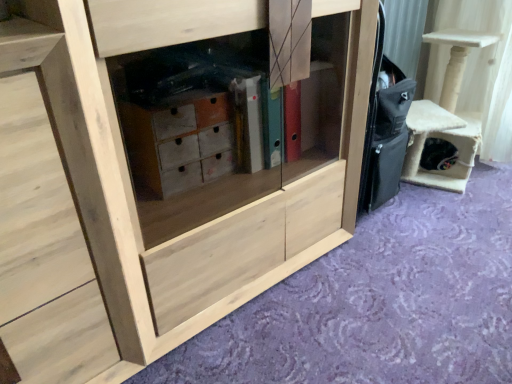
Question: Is natural wood cabinet at lower left shorter than beige felt cat house at right?

Choices:
 (A) no
 (B) yes

Answer: (A)

Question: Is natural wood cabinet at lower left further to camera compared to beige felt cat house at right?

Choices:
 (A) no
 (B) yes

Answer: (A)

Question: From a real-world perspective, is natural wood cabinet at lower left on beige felt cat house at right?

Choices:
 (A) yes
 (B) no

Answer: (A)

Question: Is natural wood cabinet at lower left turned away from beige felt cat house at right?

Choices:
 (A) yes
 (B) no

Answer: (B)

Question: Are natural wood cabinet at lower left and beige felt cat house at right far apart?

Choices:
 (A) yes
 (B) no

Answer: (A)

Question: Is natural wood cabinet at lower left in front of beige felt cat house at right?

Choices:
 (A) no
 (B) yes

Answer: (B)

Question: Can you confirm if natural wood cabinet at center is taller than beige felt cat house at right?

Choices:
 (A) yes
 (B) no

Answer: (A)

Question: Is the depth of natural wood cabinet at center greater than that of beige felt cat house at right?

Choices:
 (A) yes
 (B) no

Answer: (B)

Question: Does natural wood cabinet at center have a larger size compared to beige felt cat house at right?

Choices:
 (A) no
 (B) yes

Answer: (B)

Question: From a real-world perspective, is natural wood cabinet at center below beige felt cat house at right?

Choices:
 (A) yes
 (B) no

Answer: (B)

Question: Is beige felt cat house at right inside natural wood cabinet at center?

Choices:
 (A) no
 (B) yes

Answer: (A)

Question: Is natural wood cabinet at center facing away from beige felt cat house at right?

Choices:
 (A) yes
 (B) no

Answer: (B)

Question: Is beige felt cat house at right next to natural wood cabinet at center?

Choices:
 (A) no
 (B) yes

Answer: (A)